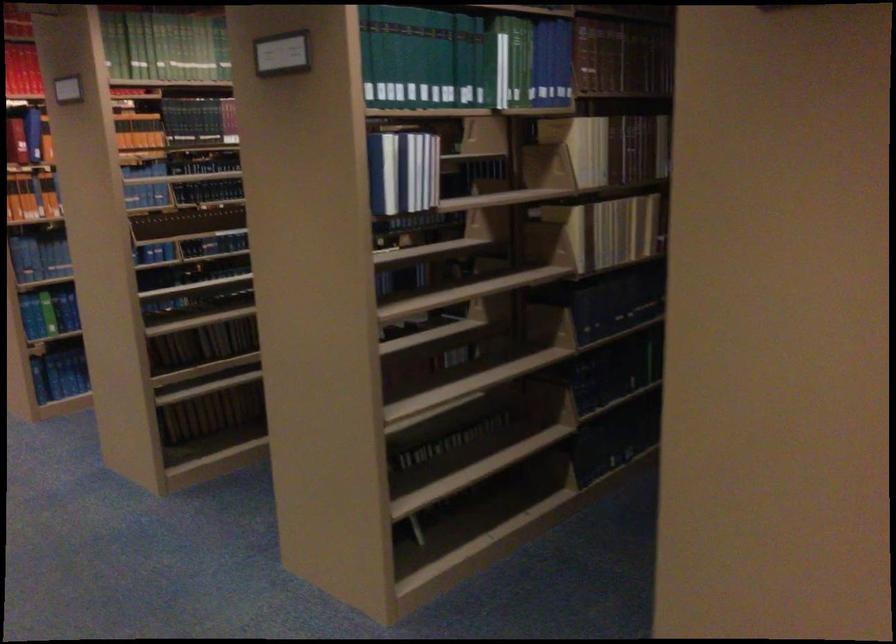
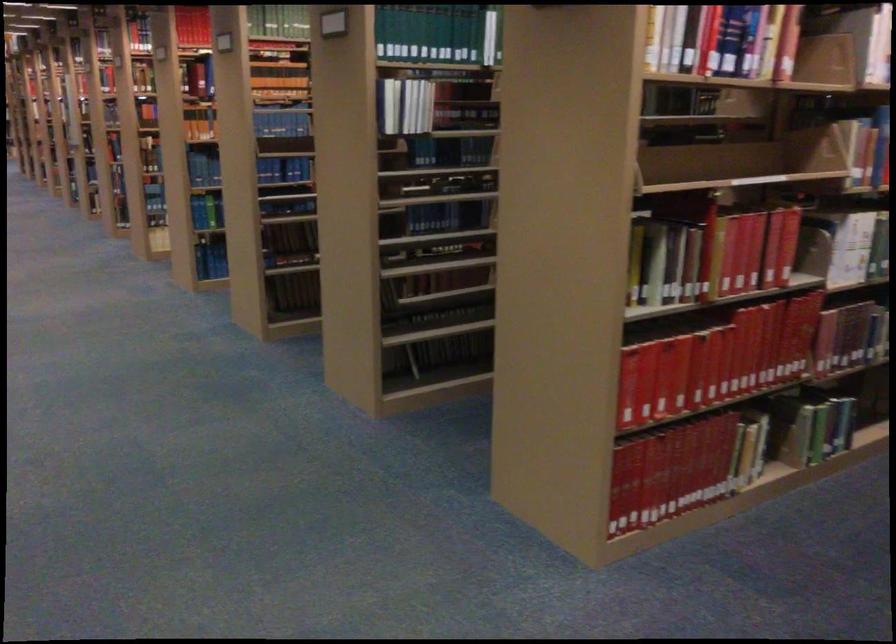
The point at (433, 67) is marked in the first image. Where is the corresponding point in the second image?

(429, 33)